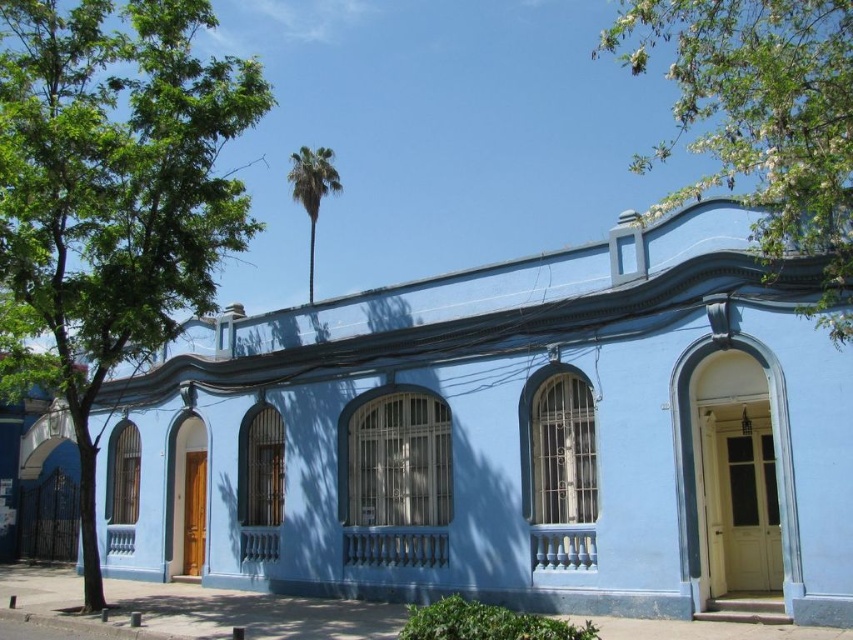
Based on the photo, you are standing in front of the blue building and want to know which tree is taller between the green leafy tree at left and the green leafy palm at upper center. Can you determine this based on their positions?

The green leafy tree at left is taller than the green leafy palm at upper center.

You are standing in front of the building and notice two green leafy trees. The first is the green leafy tree at left, and the second is the green leafy palm at upper center. Which of these trees is larger in size?

The green leafy tree at left is bigger than the green leafy palm at upper center, so the green leafy tree at left is the larger one.